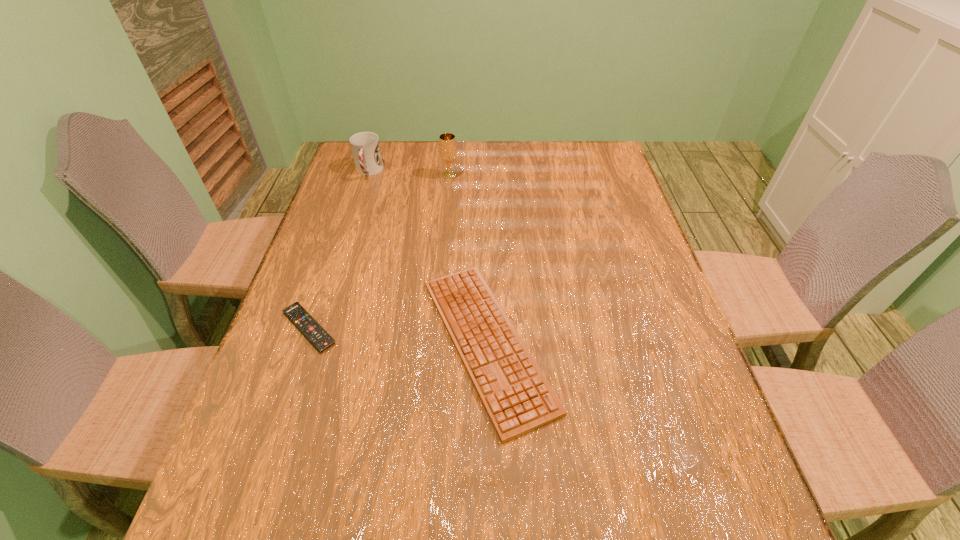
Image resolution: width=960 pixels, height=540 pixels. Find the location of `chalice`. chalice is located at coordinates (447, 143).

The width and height of the screenshot is (960, 540). What are the coordinates of `the second tallest object` in the screenshot? It's located at (365, 146).

At what (x,y) coordinates should I click in order to perform the action: click on the third tallest object. Please return your answer as a coordinate pair (x, y). Looking at the image, I should click on (517, 397).

The image size is (960, 540). What are the coordinates of `remote control` in the screenshot? It's located at (314, 332).

Where is `vacant space located 0.170m on the front of the chalice`? This screenshot has height=540, width=960. vacant space located 0.170m on the front of the chalice is located at coordinates (446, 212).

In order to click on vacant area situated on the side of the cup where the handle is located in this screenshot , I will do `click(356, 211)`.

Find the location of `vacant space located 0.050m on the left of the computer keyboard`. vacant space located 0.050m on the left of the computer keyboard is located at coordinates click(396, 343).

Locate an element on the screen. free space located on the right of the shortest object is located at coordinates (444, 328).

Identify the location of chalice present at the far edge. Image resolution: width=960 pixels, height=540 pixels. (447, 143).

The image size is (960, 540). I want to click on cup that is at the far edge, so click(x=365, y=146).